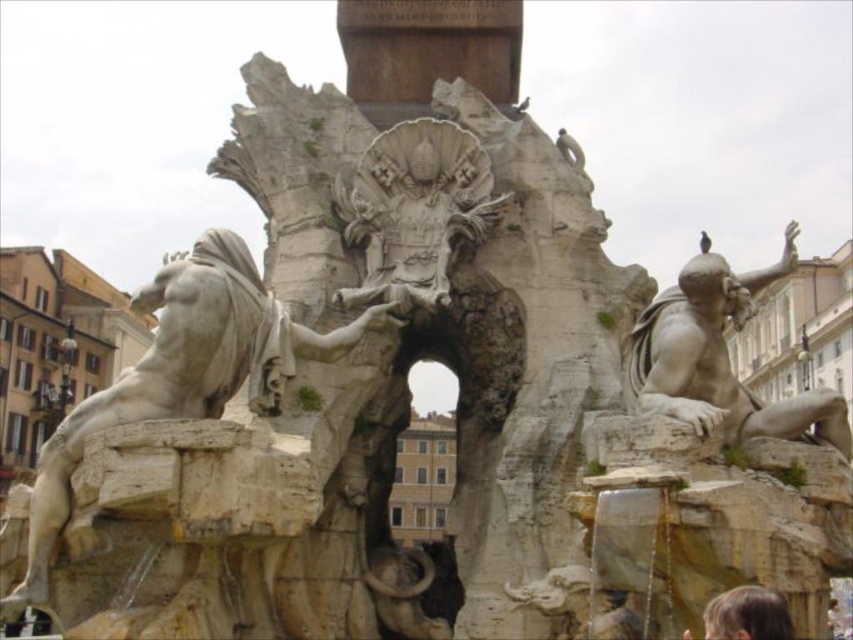
You are an art student analyzing the fountain in the historical city. You observe the white marble statue at center and the white stone sculpture at center. Which one is positioned more to the left side of the fountain?

The white marble statue at center is positioned more to the left side of the fountain than the white stone sculpture at center.

You are standing in front of the grand stone fountain and want to take a photo of the white marble statue at center. Based on its position, where should you aim your camera to capture it best?

The white marble statue at center is located at point (183, 374), so you should aim your camera slightly to the right and lower down to capture it best.